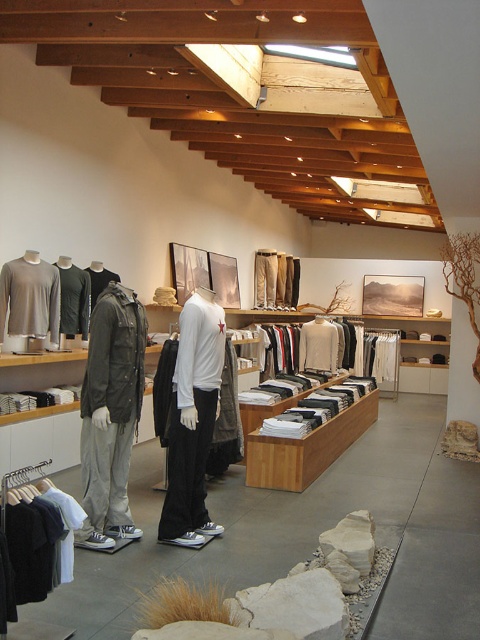
You are standing in the clothing store and want to take a photo of the point at coordinates point (21, 628). If your camera has a maximum focus range of 8 feet, will it be able to focus on that point?

The distance of point (21, 628) from camera is 8.55 feet, which exceeds the camera maximum focus range of 8 feet. Therefore, the camera will not be able to focus on that point.

A customer is standing at point [78,312] and wants to reach the entrance located at point 0.163, 0.489. Given that the store is 10 meters wide, can they walk directly to the entrance without crossing any obstacles?

The distance between the customer at point [78,312] and the entrance at point 0.163, 0.489 is 5.69 meters. Since the store is 10 meters wide, there is enough space for the customer to walk directly to the entrance without obstacles.